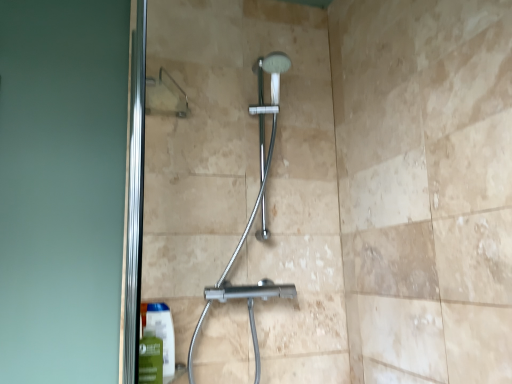
Question: Is transparent glass door at upper left in front of or behind green matte mouthwash at lower left in the image?

Choices:
 (A) front
 (B) behind

Answer: (B)

Question: From a real-world perspective, is transparent glass door at upper left above or below green matte mouthwash at lower left?

Choices:
 (A) above
 (B) below

Answer: (A)

Question: Estimate the real-world distances between objects in this image. Which object is farther from the green matte mouthwash at lower left?

Choices:
 (A) chrome metallic shower at center
 (B) transparent glass door at upper left

Answer: (B)

Question: Considering the real-world distances, which object is closest to the green matte mouthwash at lower left?

Choices:
 (A) chrome metallic shower at center
 (B) transparent glass door at upper left

Answer: (A)